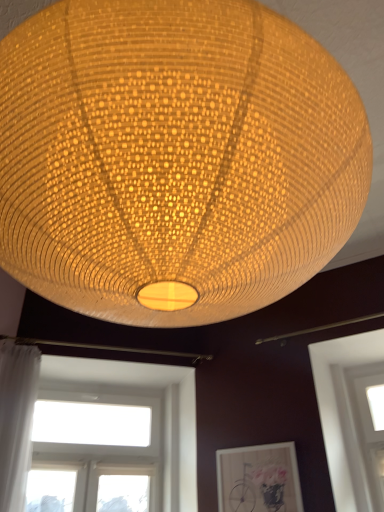
Question: Is matte woven lampshade at center wider than matte wooden picture frame at lower center?

Choices:
 (A) yes
 (B) no

Answer: (A)

Question: Is matte woven lampshade at center further to the viewer compared to matte wooden picture frame at lower center?

Choices:
 (A) yes
 (B) no

Answer: (B)

Question: From the image's perspective, is matte woven lampshade at center on top of matte wooden picture frame at lower center?

Choices:
 (A) no
 (B) yes

Answer: (B)

Question: Can you confirm if matte woven lampshade at center is smaller than matte wooden picture frame at lower center?

Choices:
 (A) no
 (B) yes

Answer: (A)

Question: From the image's perspective, does matte woven lampshade at center appear lower than matte wooden picture frame at lower center?

Choices:
 (A) no
 (B) yes

Answer: (A)

Question: Visually, is matte wooden picture frame at lower center positioned to the left or to the right of white sheer curtain at left?

Choices:
 (A) right
 (B) left

Answer: (A)

Question: Does point (228, 504) appear closer or farther from the camera than point (21, 487)?

Choices:
 (A) closer
 (B) farther

Answer: (B)

Question: In terms of width, does matte wooden picture frame at lower center look wider or thinner when compared to white sheer curtain at left?

Choices:
 (A) wide
 (B) thin

Answer: (B)

Question: In the image, is matte wooden picture frame at lower center positioned in front of or behind white sheer curtain at left?

Choices:
 (A) front
 (B) behind

Answer: (B)

Question: From a real-world perspective, is white sheer curtain at left physically located above or below matte woven lampshade at center?

Choices:
 (A) above
 (B) below

Answer: (B)

Question: Is white sheer curtain at left to the left or to the right of matte woven lampshade at center in the image?

Choices:
 (A) right
 (B) left

Answer: (B)

Question: In terms of width, does white sheer curtain at left look wider or thinner when compared to matte woven lampshade at center?

Choices:
 (A) wide
 (B) thin

Answer: (B)

Question: Relative to matte woven lampshade at center, is white sheer curtain at left in front or behind?

Choices:
 (A) behind
 (B) front

Answer: (A)

Question: From a real-world perspective, is matte woven lampshade at center positioned above or below transparent glass window at lower right, the first window from the right?

Choices:
 (A) above
 (B) below

Answer: (A)

Question: Considering the relative positions of matte woven lampshade at center and transparent glass window at lower right, the second window positioned from the left, in the image provided, is matte woven lampshade at center to the left or to the right of transparent glass window at lower right, the second window positioned from the left,?

Choices:
 (A) right
 (B) left

Answer: (B)